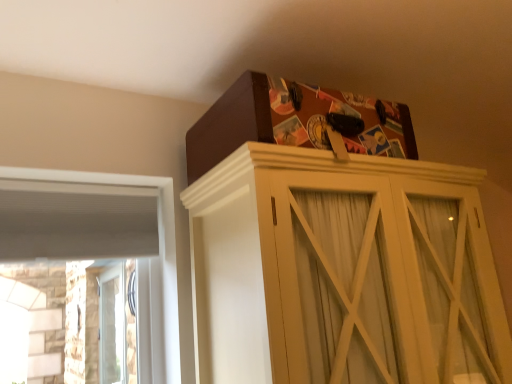
Measure the distance between point (236, 304) and camera.

Point (236, 304) is 1.28 meters away from camera.

Identify the location of matte brown cabinet at upper center. (336, 269).

What do you see at coordinates (296, 122) in the screenshot? I see `brown cardboard box at upper center` at bounding box center [296, 122].

Identify the location of white wood frame at left. (99, 234).

Would you consider brown cardboard box at upper center to be distant from matte brown cabinet at upper center?

They are positioned close to each other.

From the image's perspective, would you say brown cardboard box at upper center is shown under matte brown cabinet at upper center?

No, from the image's perspective, brown cardboard box at upper center is not below matte brown cabinet at upper center.

At what (x,y) coordinates should I click in order to perform the action: click on cupboard below the brown cardboard box at upper center (from a real-world perspective). Please return your answer as a coordinate pair (x, y). The image size is (512, 384). Looking at the image, I should click on (336, 269).

From a real-world perspective, which is physically below, brown cardboard box at upper center or matte brown cabinet at upper center?

From a 3D spatial view, matte brown cabinet at upper center is below.

Is white wood frame at left located outside matte brown cabinet at upper center?

Yes, white wood frame at left is not within matte brown cabinet at upper center.

From a real-world perspective, is white wood frame at left above or below matte brown cabinet at upper center?

In terms of real-world spatial position, white wood frame at left is above matte brown cabinet at upper center.

Who is smaller, white wood frame at left or matte brown cabinet at upper center?

white wood frame at left.

Considering the relative sizes of white wood frame at left and matte brown cabinet at upper center in the image provided, is white wood frame at left thinner than matte brown cabinet at upper center?

Indeed, white wood frame at left has a lesser width compared to matte brown cabinet at upper center.

Considering the sizes of objects matte brown cabinet at upper center and brown cardboard box at upper center in the image provided, who is thinner, matte brown cabinet at upper center or brown cardboard box at upper center?

Thinner between the two is brown cardboard box at upper center.

Is matte brown cabinet at upper center facing towards brown cardboard box at upper center?

No, matte brown cabinet at upper center is not turned towards brown cardboard box at upper center.

From the picture: Is matte brown cabinet at upper center far from brown cardboard box at upper center?

No, there isn't a large distance between matte brown cabinet at upper center and brown cardboard box at upper center.

In the image, is matte brown cabinet at upper center positioned in front of or behind brown cardboard box at upper center?

matte brown cabinet at upper center is in front of brown cardboard box at upper center.

Would you say matte brown cabinet at upper center is outside white wood frame at left?

Yes, matte brown cabinet at upper center is outside of white wood frame at left.

From a real-world perspective, does matte brown cabinet at upper center stand above white wood frame at left?

No, from a real-world perspective, matte brown cabinet at upper center is not over white wood frame at left

Is matte brown cabinet at upper center to the left or to the right of white wood frame at left in the image?

From the image, it's evident that matte brown cabinet at upper center is to the right of white wood frame at left.

Locate an element on the screen. Image resolution: width=512 pixels, height=384 pixels. cupboard beneath the white wood frame at left (from a real-world perspective) is located at coordinates (336, 269).

Would you say white wood frame at left contains brown cardboard box at upper center?

No, white wood frame at left does not contain brown cardboard box at upper center.

Is white wood frame at left bigger or smaller than brown cardboard box at upper center?

white wood frame at left is smaller than brown cardboard box at upper center.

Between white wood frame at left and brown cardboard box at upper center, which one has less height?

→ Standing shorter between the two is brown cardboard box at upper center.

In the scene shown: Is white wood frame at left in front of brown cardboard box at upper center?

No, white wood frame at left is behind brown cardboard box at upper center.

Considering the sizes of objects brown cardboard box at upper center and white wood frame at left in the image provided, who is wider, brown cardboard box at upper center or white wood frame at left?

Wider between the two is brown cardboard box at upper center.

In terms of height, does brown cardboard box at upper center look taller or shorter compared to white wood frame at left?

brown cardboard box at upper center is shorter than white wood frame at left.

From the image's perspective, does brown cardboard box at upper center appear higher than white wood frame at left?

Yes, from the image's perspective, brown cardboard box at upper center is over white wood frame at left.

From a real-world perspective, relative to white wood frame at left, is brown cardboard box at upper center vertically above or below?

In terms of real-world spatial position, brown cardboard box at upper center is above white wood frame at left.

Locate an element on the screen. The image size is (512, 384). cardboard box above the matte brown cabinet at upper center (from a real-world perspective) is located at coordinates (296, 122).

Where is `window behind the matte brown cabinet at upper center`? The width and height of the screenshot is (512, 384). window behind the matte brown cabinet at upper center is located at coordinates (99, 234).

Which object lies further to the anchor point white wood frame at left, matte brown cabinet at upper center or brown cardboard box at upper center?

Based on the image, matte brown cabinet at upper center appears to be further to white wood frame at left.

Considering their positions, is white wood frame at left positioned closer to matte brown cabinet at upper center than brown cardboard box at upper center?

brown cardboard box at upper center.

Considering their positions, is brown cardboard box at upper center positioned closer to matte brown cabinet at upper center than white wood frame at left?

brown cardboard box at upper center is positioned closer to the anchor matte brown cabinet at upper center.

Estimate the real-world distances between objects in this image. Which object is closer to brown cardboard box at upper center, white wood frame at left or matte brown cabinet at upper center?

matte brown cabinet at upper center lies closer to brown cardboard box at upper center than the other object.

Estimate the real-world distances between objects in this image. Which object is closer to brown cardboard box at upper center, matte brown cabinet at upper center or white wood frame at left?

matte brown cabinet at upper center lies closer to brown cardboard box at upper center than the other object.

From the image, which object appears to be nearer to white wood frame at left, brown cardboard box at upper center or matte brown cabinet at upper center?

The object closer to white wood frame at left is brown cardboard box at upper center.

Where is `cardboard box located between white wood frame at left and matte brown cabinet at upper center in the left-right direction`? cardboard box located between white wood frame at left and matte brown cabinet at upper center in the left-right direction is located at coordinates (296, 122).